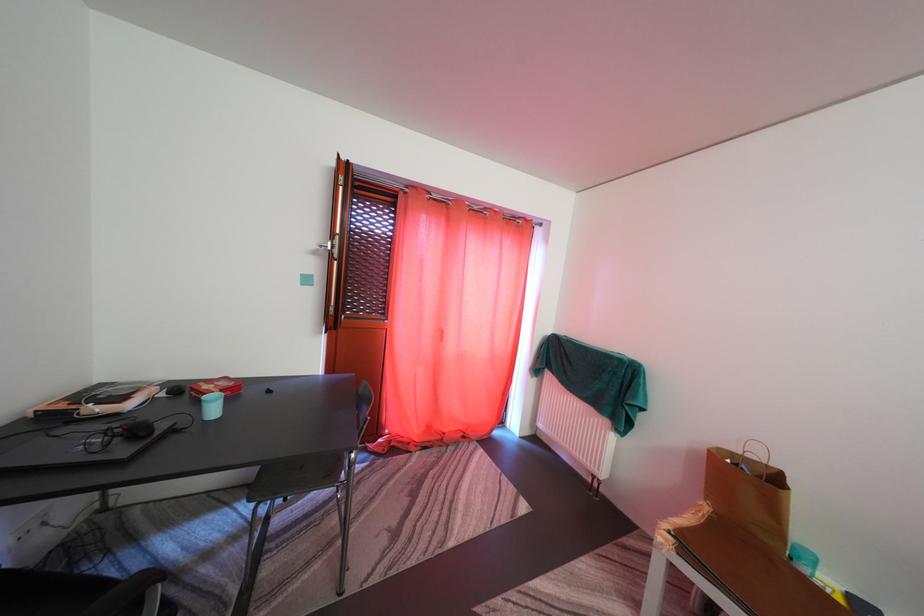
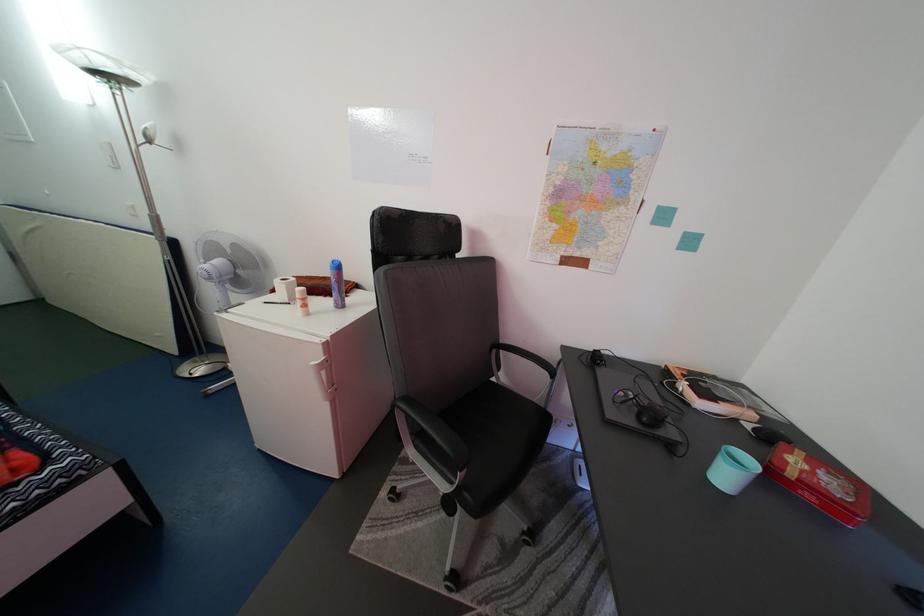
The point at (128, 447) is marked in the first image. Where is the corresponding point in the second image?

(646, 416)